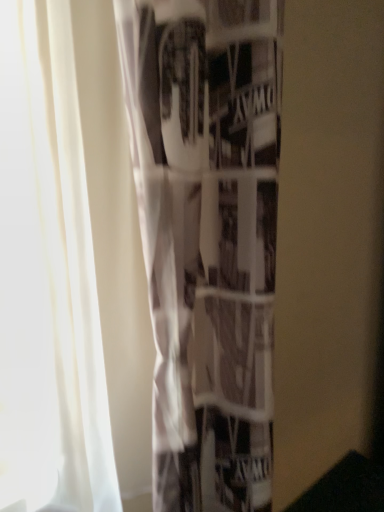
The height and width of the screenshot is (512, 384). What are the coordinates of `white sheer fabric at center` in the screenshot? It's located at point(207,237).

This screenshot has width=384, height=512. What do you see at coordinates (207, 237) in the screenshot?
I see `white sheer fabric at center` at bounding box center [207, 237].

Image resolution: width=384 pixels, height=512 pixels. In order to click on white sheer fabric at center in this screenshot , I will do `click(207, 237)`.